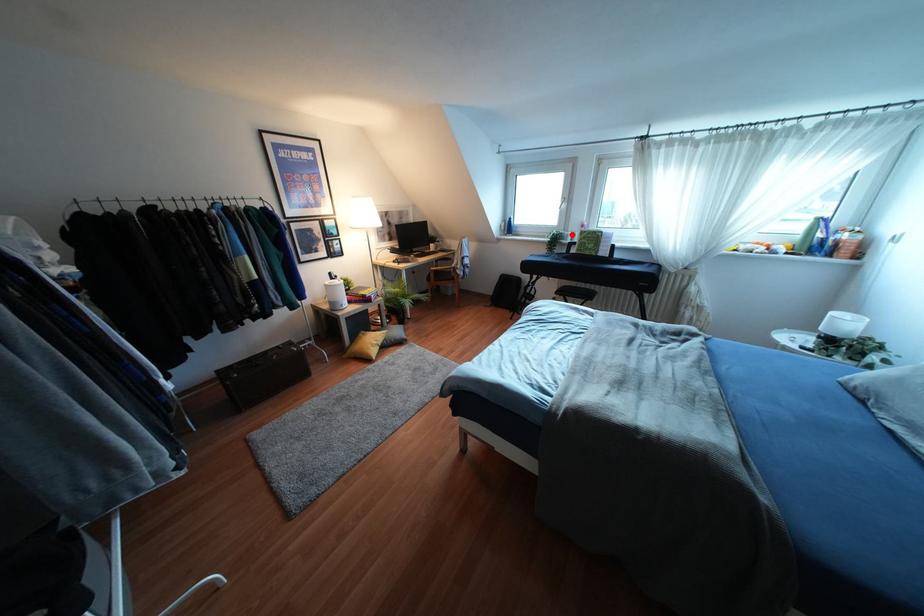
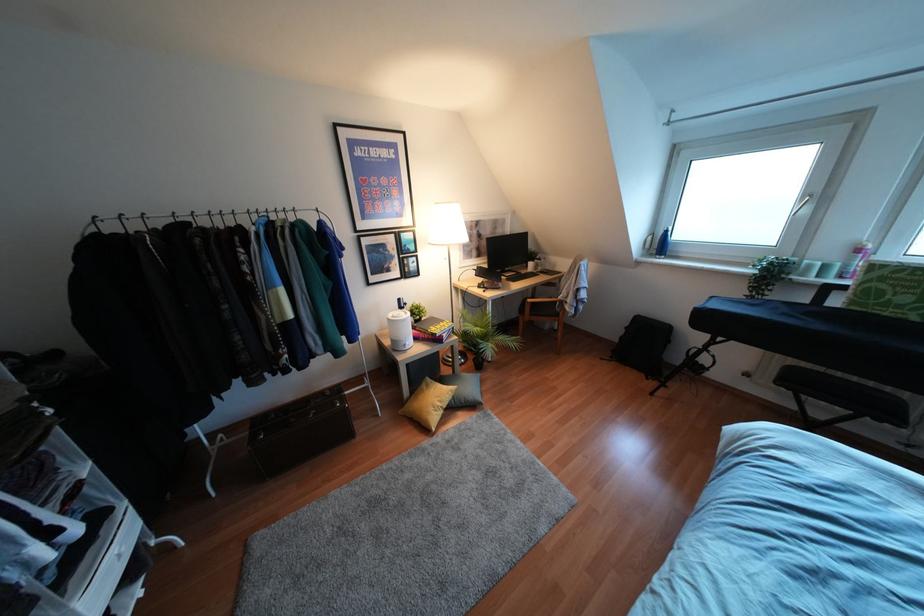
In the second image, find the point that corresponds to the highlighted location in the first image.

(824, 267)